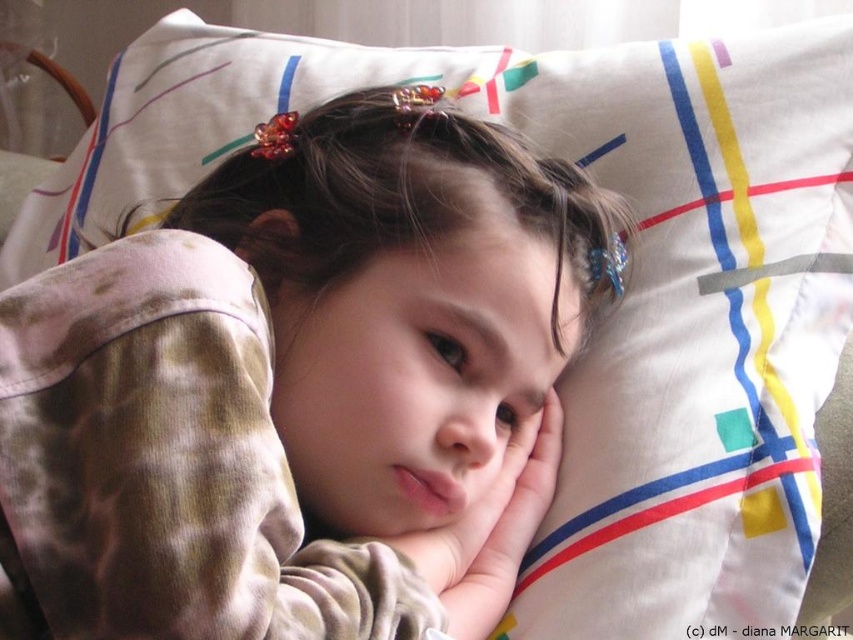
You are taking a photo of a child lying on a colorful pillow. The camera is positioned at a certain distance. There is a point at coordinates point (123, 497). Can you determine if this point is close enough to the camera to be in focus?

The point (123, 497) is 13.23 inches away from the camera, so it is close enough to be in focus.

You are a parent trying to find your child who is wearing camouflage pajamas at center. According to the image, where exactly is the child located in the room?

The camouflage pajamas at center is located at point (302,388), so the child wearing them is at that position in the room.

You are a parent checking on your child in their bedroom. You notice the camouflage pajamas at center and the soft skin hand at center. Which of these two items is taller?

The camouflage pajamas at center are taller than the soft skin hand at center.